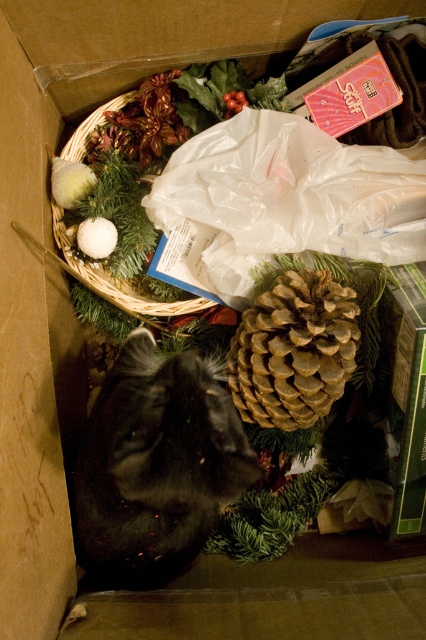
Question: Is black fluffy cat at lower left to the left of woven straw basket at upper left from the viewer's perspective?

Choices:
 (A) no
 (B) yes

Answer: (A)

Question: Which point is farther to the camera?

Choices:
 (A) woven straw basket at upper left
 (B) brown textured pine cone at center

Answer: (A)

Question: Which point is closer to the camera taking this photo?

Choices:
 (A) (72, 157)
 (B) (244, 406)

Answer: (B)

Question: Which point is farther from the camera taking this photo?

Choices:
 (A) (x=86, y=467)
 (B) (x=129, y=291)
 (C) (x=253, y=419)

Answer: (B)

Question: Is brown textured pine cone at center below woven straw basket at upper left?

Choices:
 (A) no
 (B) yes

Answer: (B)

Question: Is black fluffy cat at lower left bigger than brown textured pine cone at center?

Choices:
 (A) no
 (B) yes

Answer: (B)